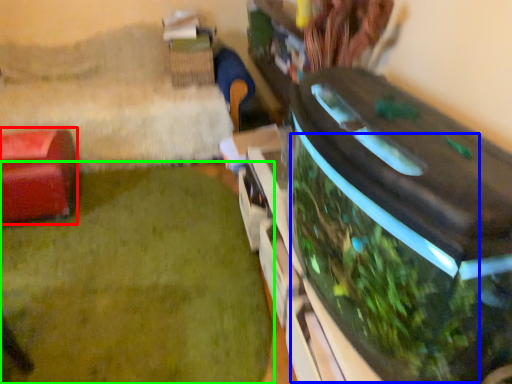
Question: Estimate the real-world distances between objects in this image. Which object is closer to furniture (highlighted by a red box), vegetation (highlighted by a blue box) or plant (highlighted by a green box)?

Choices:
 (A) vegetation
 (B) plant

Answer: (B)